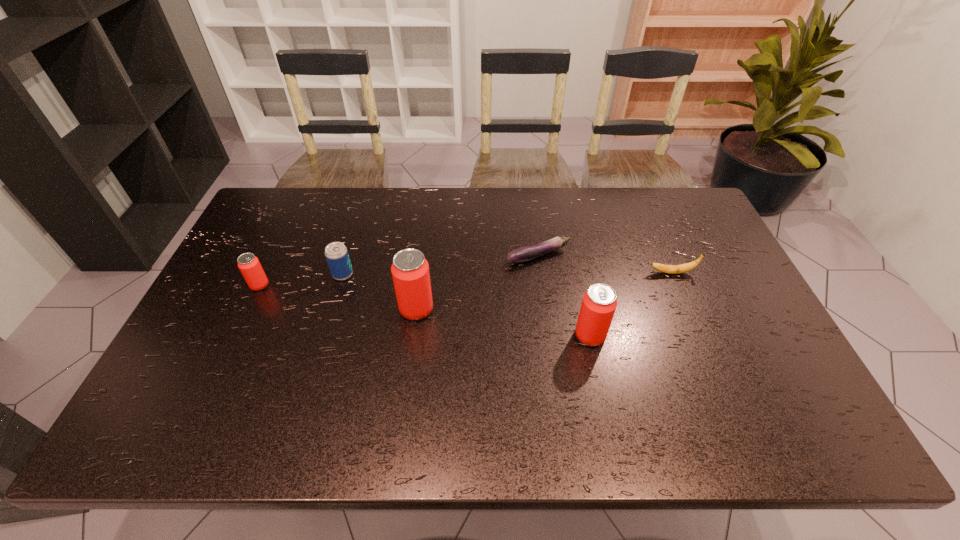
The image size is (960, 540). I want to click on blank region between the second nearest beer can and the eggplant, so click(477, 282).

Choose which object is the fourth nearest neighbor to the shortest object. Please provide its 2D coordinates. Your answer should be formatted as a tuple, i.e. [(x, y)], where the tuple contains the x and y coordinates of a point satisfying the conditions above.

[(336, 253)]

Point out which object is positioned as the fifth nearest to the rightmost beer can. Please provide its 2D coordinates. Your answer should be formatted as a tuple, i.e. [(x, y)], where the tuple contains the x and y coordinates of a point satisfying the conditions above.

[(249, 265)]

Locate an element on the screen. The image size is (960, 540). beer can that is the third closest to the third beer can from right to left is located at coordinates (599, 303).

Image resolution: width=960 pixels, height=540 pixels. I want to click on the third closest beer can to the leftmost beer can, so (x=599, y=303).

Locate an element on the screen. This screenshot has height=540, width=960. vacant space that satisfies the following two spatial constraints: 1. on the peel of the banana from the top; 2. on the front side of the second object from left to right is located at coordinates (672, 274).

Locate an element on the screen. The width and height of the screenshot is (960, 540). vacant region that satisfies the following two spatial constraints: 1. on the peel of the rightmost object from the top; 2. on the front side of the fourth object from right to left is located at coordinates (687, 309).

I want to click on vacant space that satisfies the following two spatial constraints: 1. on the peel of the fifth tallest object from the top; 2. on the front side of the nearest beer can, so click(x=698, y=336).

In order to click on free space that satisfies the following two spatial constraints: 1. on the peel of the banana from the top; 2. on the front side of the second beer can from left to right in this screenshot , I will do `click(672, 274)`.